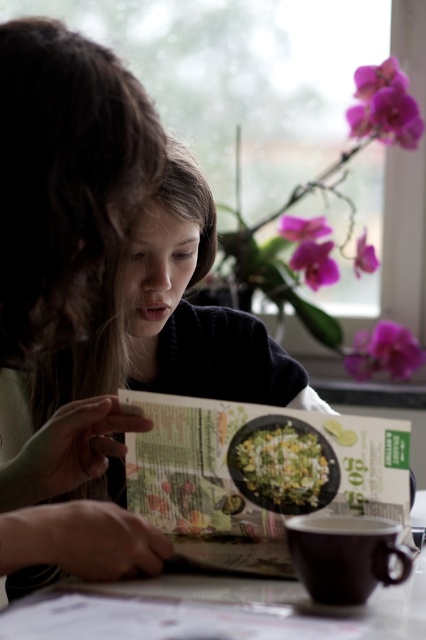
Can you confirm if matte black book at center is positioned above purple glossy orchid at upper right?

No.

Does matte black book at center have a larger size compared to purple glossy orchid at upper right?

No, matte black book at center is not bigger than purple glossy orchid at upper right.

This screenshot has width=426, height=640. I want to click on matte black book at center, so click(63, 177).

At what (x,y) coordinates should I click in order to perform the action: click on matte black book at center. Please return your answer as a coordinate pair (x, y). Looking at the image, I should click on (63, 177).

Is matte black book at center above printed paper book at center?

Yes, matte black book at center is above printed paper book at center.

Describe the element at coordinates (63, 177) in the screenshot. Image resolution: width=426 pixels, height=640 pixels. I see `matte black book at center` at that location.

Is point (48, 481) closer to viewer compared to point (276, 448)?

No.

Locate an element on the screen. This screenshot has width=426, height=640. matte black book at center is located at coordinates click(x=63, y=177).

Between point (71, 384) and point (255, 460), which one is positioned behind?

The point (71, 384) is more distant.

Which is in front, point (172, 161) or point (307, 449)?

Positioned in front is point (307, 449).

Locate an element on the screen. The image size is (426, 640). smooth black hair at center is located at coordinates (157, 324).